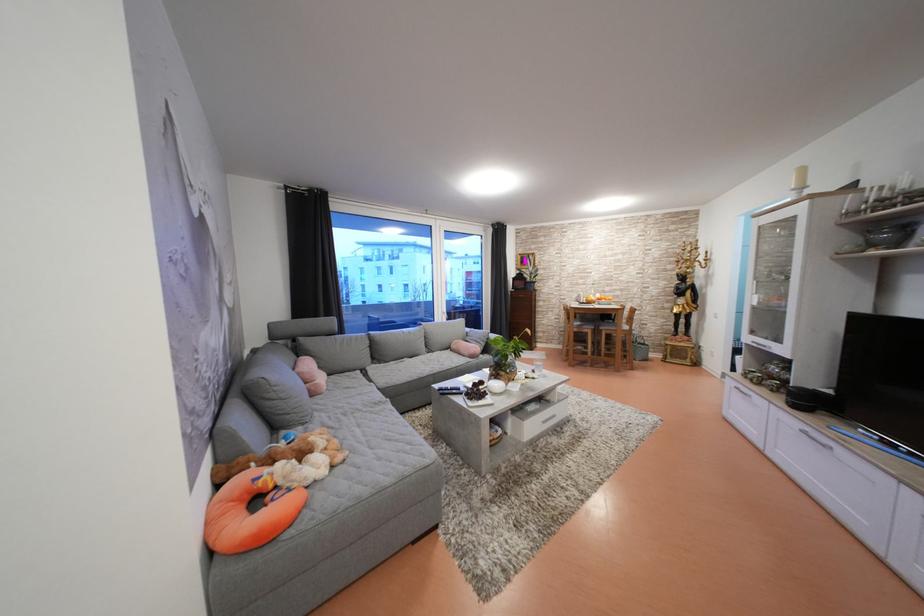
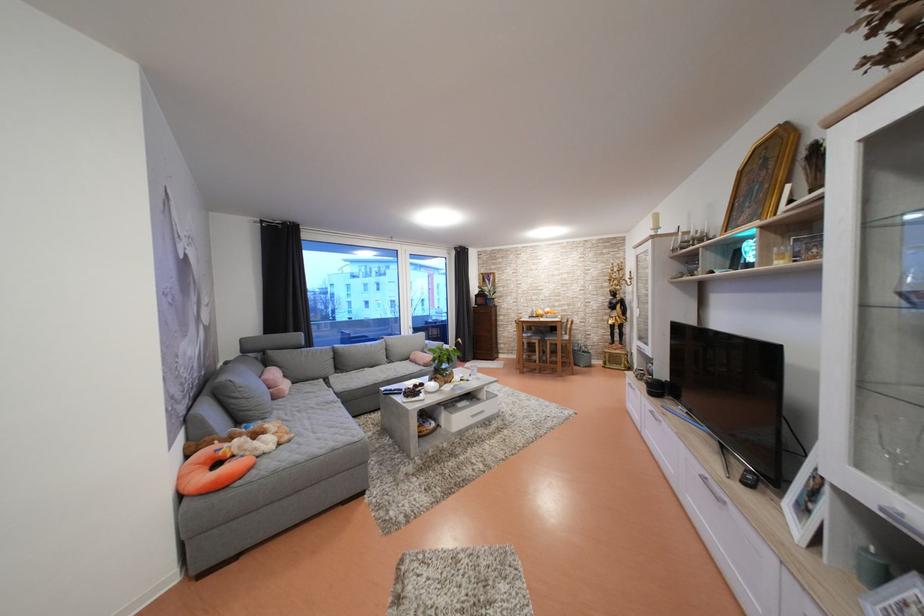
The point at (810,437) is marked in the first image. Where is the corresponding point in the second image?

(659, 416)